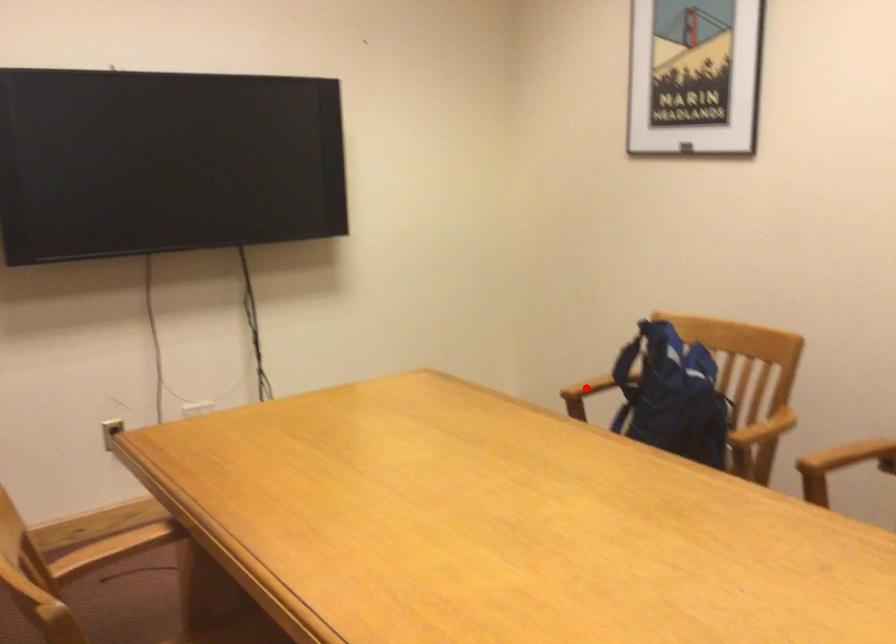
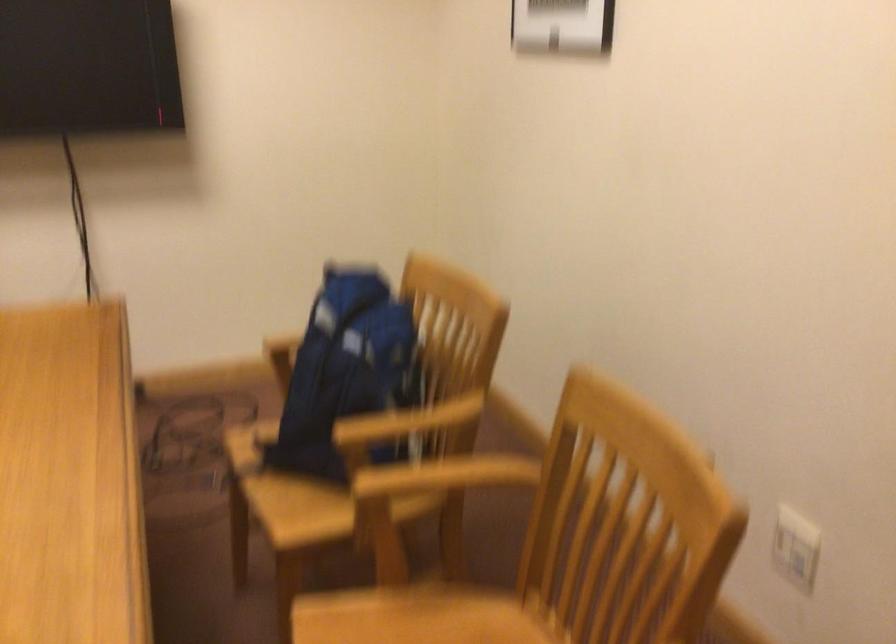
Question: I am providing you with two images of the same scene from different viewpoints. A red point is marked on the first image. Is the red point's position out of view in image 2?

Choices:
 (A) Yes
 (B) No

Answer: (A)